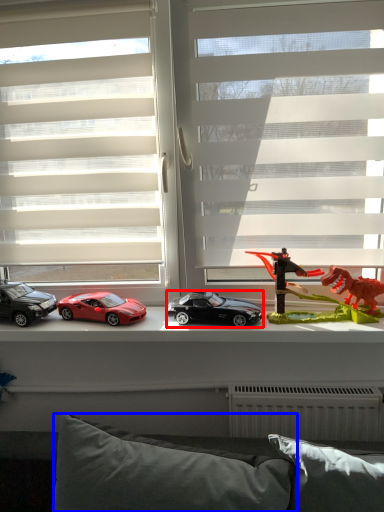
Question: Which object is further to the camera taking this photo, car (highlighted by a red box) or pillow (highlighted by a blue box)?

Choices:
 (A) car
 (B) pillow

Answer: (A)